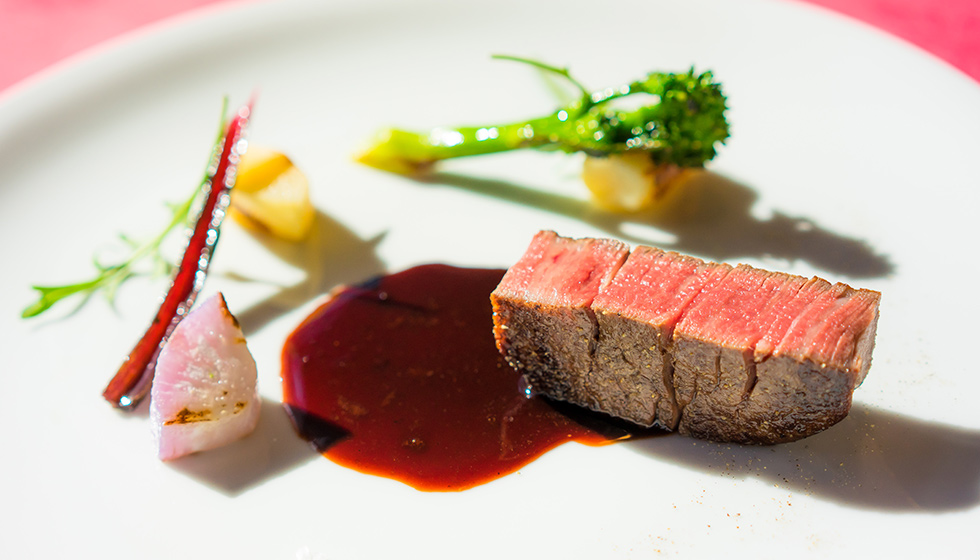
Where is `table`? The height and width of the screenshot is (560, 980). table is located at coordinates (956, 43).